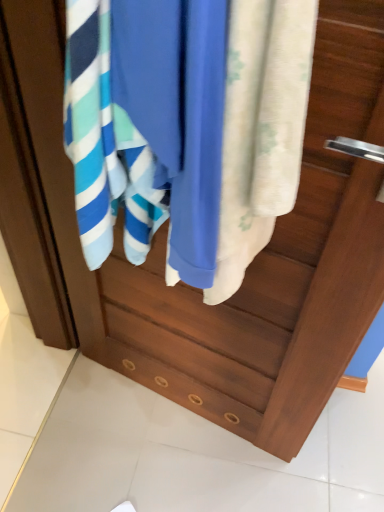
Identify the location of free spot below blue cotton towel at center (from a real-world perspective). (168, 394).